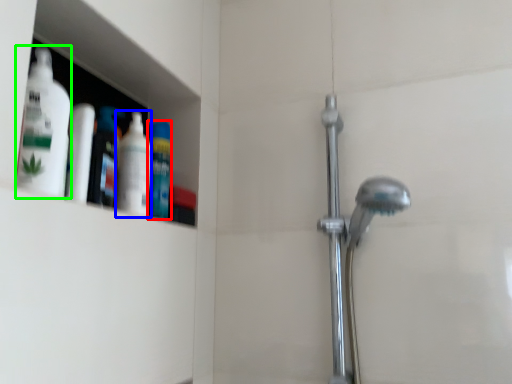
Question: Which object is positioned closest to mouthwash (highlighted by a red box)? Select from cleaning product (highlighted by a blue box) and cleaning product (highlighted by a green box).

Choices:
 (A) cleaning product
 (B) cleaning product

Answer: (A)